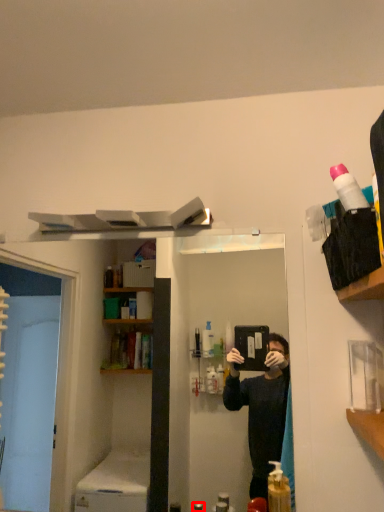
Question: From the image's perspective, what is the correct spatial positioning of toiletry (annotated by the red box) in reference to cleaning product?

Choices:
 (A) below
 (B) above

Answer: (A)